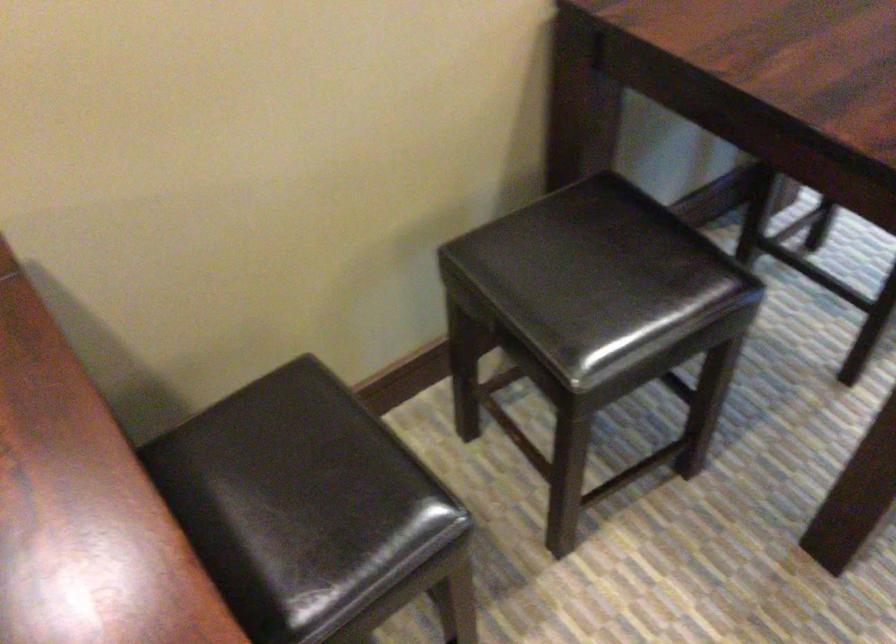
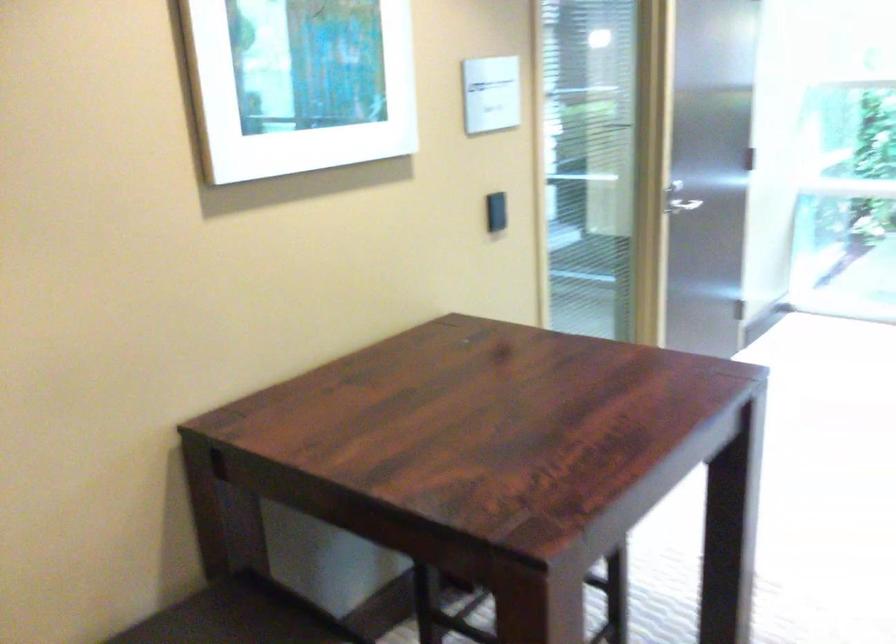
The first image is from the beginning of the video and the second image is from the end. How did the camera likely rotate when shooting the video?

The camera's rotation is toward right-up.